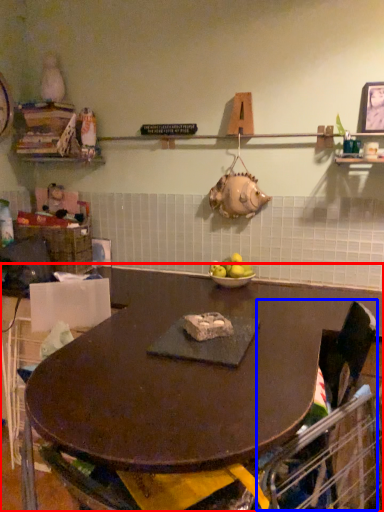
Question: Which point is closer to the camera, table (highlighted by a red box) or swivel chair (highlighted by a blue box)?

Choices:
 (A) table
 (B) swivel chair

Answer: (A)